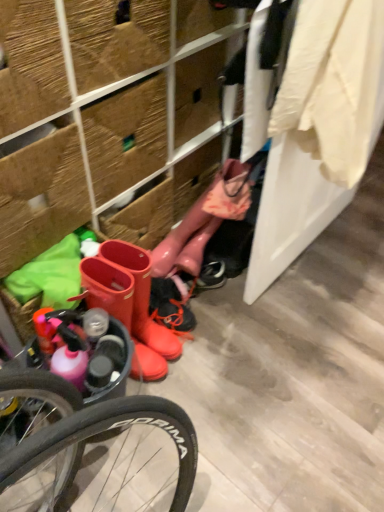
Question: Does glossy rubber boot at center come in front of rubber boots at lower left?

Choices:
 (A) yes
 (B) no

Answer: (B)

Question: Can you confirm if glossy rubber boot at center is positioned to the right of rubber boots at lower left?

Choices:
 (A) no
 (B) yes

Answer: (B)

Question: From a real-world perspective, is glossy rubber boot at center physically below rubber boots at lower left?

Choices:
 (A) yes
 (B) no

Answer: (A)

Question: Is glossy rubber boot at center not inside rubber boots at lower left?

Choices:
 (A) yes
 (B) no

Answer: (A)

Question: From a real-world perspective, is glossy rubber boot at center over rubber boots at lower left?

Choices:
 (A) no
 (B) yes

Answer: (A)

Question: Visually, is rubber boots at center positioned to the left or to the right of white cotton shirt at upper right?

Choices:
 (A) left
 (B) right

Answer: (A)

Question: Is rubber boots at center bigger or smaller than white cotton shirt at upper right?

Choices:
 (A) big
 (B) small

Answer: (B)

Question: Considering the positions of rubber boots at center and white cotton shirt at upper right in the image, is rubber boots at center wider or thinner than white cotton shirt at upper right?

Choices:
 (A) thin
 (B) wide

Answer: (B)

Question: From a real-world perspective, is rubber boots at center physically located above or below white cotton shirt at upper right?

Choices:
 (A) above
 (B) below

Answer: (B)

Question: Considering the positions of glossy rubber boot at center and white cotton shirt at upper right in the image, is glossy rubber boot at center wider or thinner than white cotton shirt at upper right?

Choices:
 (A) thin
 (B) wide

Answer: (A)

Question: Is glossy rubber boot at center taller or shorter than white cotton shirt at upper right?

Choices:
 (A) short
 (B) tall

Answer: (A)

Question: Based on their sizes in the image, would you say glossy rubber boot at center is bigger or smaller than white cotton shirt at upper right?

Choices:
 (A) small
 (B) big

Answer: (A)

Question: Based on their positions, is glossy rubber boot at center located to the left or right of white cotton shirt at upper right?

Choices:
 (A) right
 (B) left

Answer: (B)

Question: From the image's perspective, relative to rubber boots at lower left, is rubber boots at center above or below?

Choices:
 (A) below
 (B) above

Answer: (A)

Question: Considering the positions of rubber boots at center and rubber boots at lower left in the image, is rubber boots at center wider or thinner than rubber boots at lower left?

Choices:
 (A) thin
 (B) wide

Answer: (A)